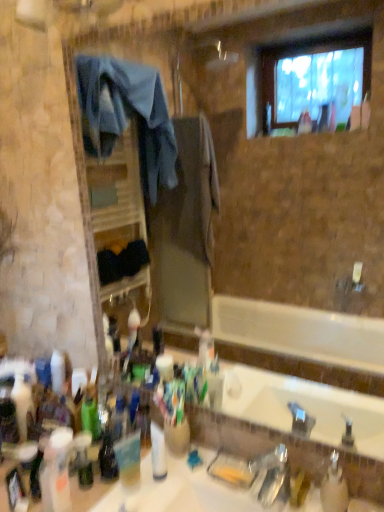
Question: Are yellow matte soap dispenser at lower right, the 3th toiletry from the left, and translucent plastic bottle at lower left, the third bottle when ordered from right to left, located far from each other?

Choices:
 (A) no
 (B) yes

Answer: (A)

Question: Does yellow matte soap dispenser at lower right, the 3th toiletry from the left, appear on the right side of translucent plastic bottle at lower left, marked as the third bottle in a left-to-right arrangement?

Choices:
 (A) yes
 (B) no

Answer: (A)

Question: From the image's perspective, is yellow matte soap dispenser at lower right, the first toiletry viewed from the right, under translucent plastic bottle at lower left, marked as the third bottle in a left-to-right arrangement?

Choices:
 (A) yes
 (B) no

Answer: (A)

Question: Does yellow matte soap dispenser at lower right, the first toiletry viewed from the right, have a greater width compared to translucent plastic bottle at lower left, which is the 2th bottle in back-to-front order?

Choices:
 (A) yes
 (B) no

Answer: (A)

Question: Is yellow matte soap dispenser at lower right, the 3th toiletry from the left, bigger than translucent plastic bottle at lower left, the 4th bottle viewed from the front?

Choices:
 (A) yes
 (B) no

Answer: (B)

Question: From the image's perspective, is white glossy sink at center located above or below translucent plastic cup at lower center?

Choices:
 (A) below
 (B) above

Answer: (A)

Question: In terms of height, does white glossy sink at center look taller or shorter compared to translucent plastic cup at lower center?

Choices:
 (A) tall
 (B) short

Answer: (A)

Question: Visually, is white glossy sink at center positioned to the left or to the right of translucent plastic cup at lower center?

Choices:
 (A) left
 (B) right

Answer: (B)

Question: Looking at the image, does white glossy sink at center seem bigger or smaller compared to translucent plastic cup at lower center?

Choices:
 (A) big
 (B) small

Answer: (A)

Question: Considering the relative positions of green matte bottle at lower left, which is counted as the 5th bottle, starting from the front, and metallic silver faucet at lower center in the image provided, is green matte bottle at lower left, which is counted as the 5th bottle, starting from the front, to the left or to the right of metallic silver faucet at lower center?

Choices:
 (A) right
 (B) left

Answer: (B)

Question: Considering the positions of point (91, 425) and point (271, 478), is point (91, 425) closer or farther from the camera than point (271, 478)?

Choices:
 (A) farther
 (B) closer

Answer: (A)

Question: Choose the correct answer: Is green matte bottle at lower left, arranged as the 2th bottle when viewed from the left, inside metallic silver faucet at lower center or outside it?

Choices:
 (A) inside
 (B) outside

Answer: (B)

Question: From a real-world perspective, relative to metallic silver faucet at lower center, is green matte bottle at lower left, which is the 4th bottle from right to left, vertically above or below?

Choices:
 (A) below
 (B) above

Answer: (A)

Question: Does point (139, 496) appear closer or farther from the camera than point (92, 401)?

Choices:
 (A) closer
 (B) farther

Answer: (A)

Question: Considering the positions of white glossy sink at center and green matte bottle at lower left, which is counted as the 5th bottle, starting from the front, in the image, is white glossy sink at center taller or shorter than green matte bottle at lower left, which is counted as the 5th bottle, starting from the front,?

Choices:
 (A) tall
 (B) short

Answer: (A)